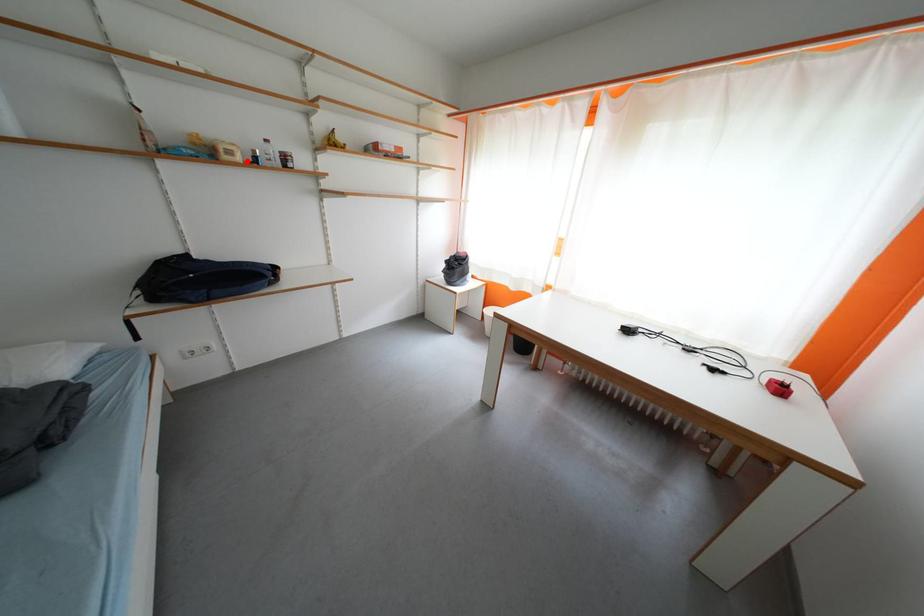
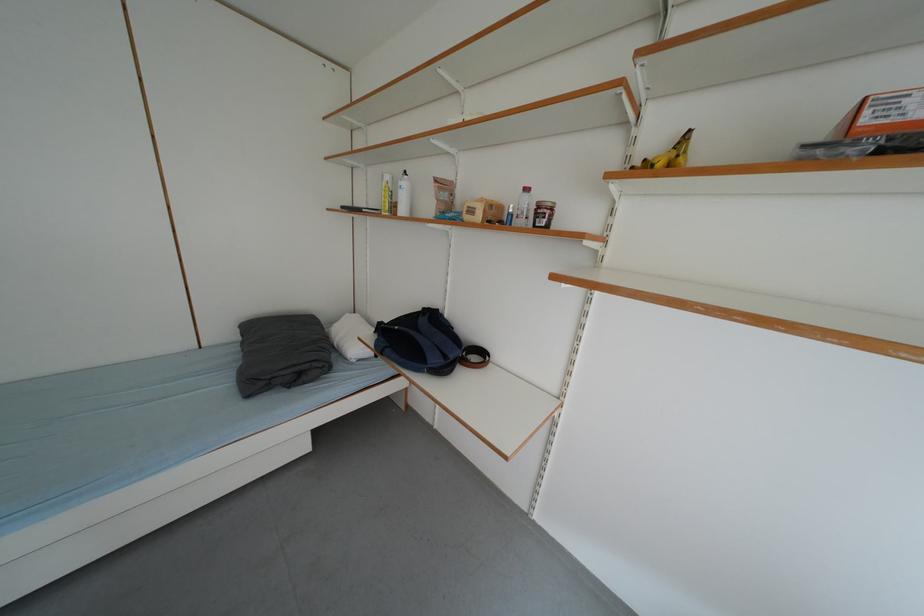
Locate, in the second image, the point that corresponds to the highlighted location in the first image.

(487, 220)